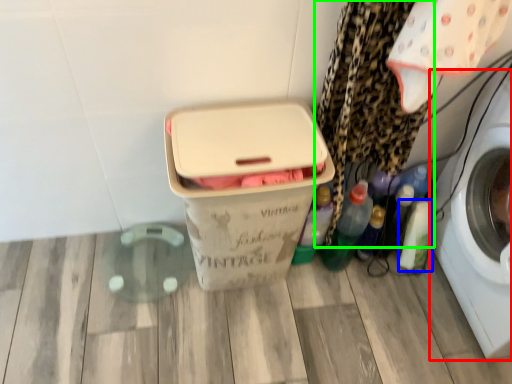
Question: Which is farther away from washing machine (highlighted by a red box)? bottle (highlighted by a blue box) or curtain (highlighted by a green box)?

Choices:
 (A) bottle
 (B) curtain

Answer: (B)